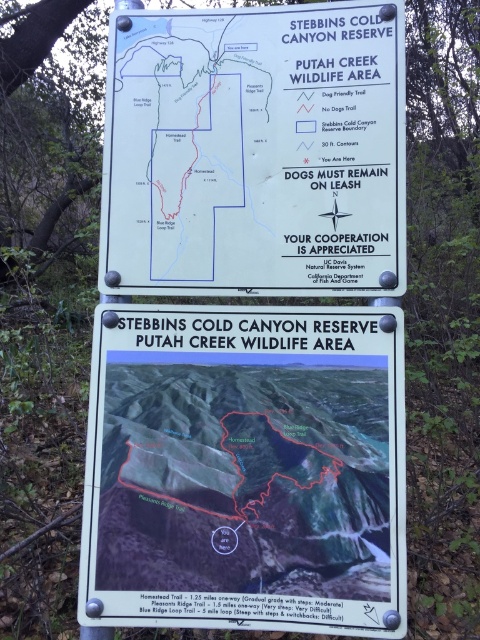
Question: From the image, what is the correct spatial relationship of white plastic sign at center in relation to white paper sign at upper center?

Choices:
 (A) below
 (B) above

Answer: (A)

Question: From the image, what is the correct spatial relationship of white plastic sign at center in relation to white paper sign at upper center?

Choices:
 (A) right
 (B) left

Answer: (B)

Question: Which point is closer to the camera taking this photo?

Choices:
 (A) (295, 312)
 (B) (298, 211)

Answer: (A)

Question: Among these objects, which one is nearest to the camera?

Choices:
 (A) white paper sign at upper center
 (B) white plastic sign at center

Answer: (B)

Question: Does white plastic sign at center appear on the left side of white paper sign at upper center?

Choices:
 (A) yes
 (B) no

Answer: (A)